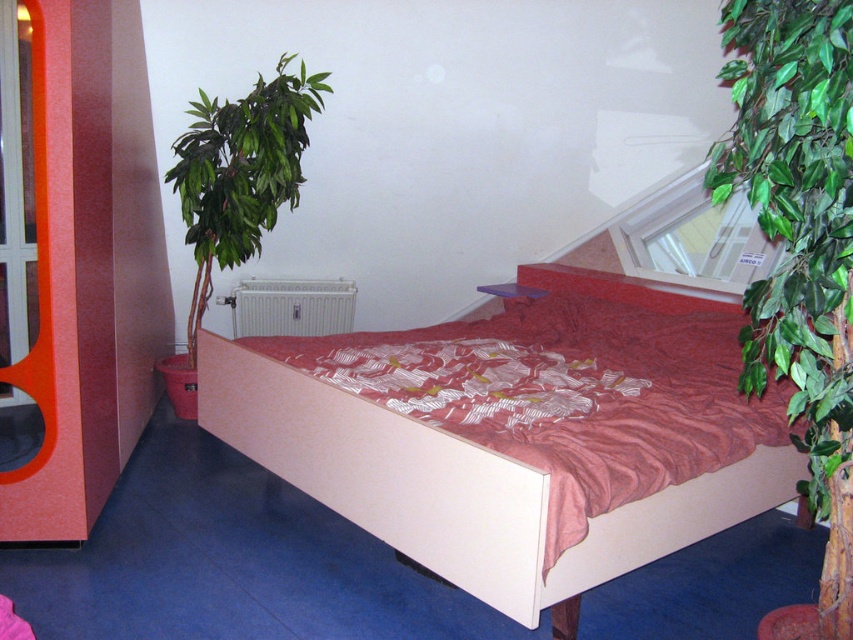
Question: Is matte white bed at center above white metallic radiator at center?

Choices:
 (A) yes
 (B) no

Answer: (B)

Question: Which object is positioned farthest from the white metallic radiator at center?

Choices:
 (A) green leafy plant at right
 (B) green leafy plant at left
 (C) matte white bed at center

Answer: (A)

Question: Which point is closer to the camera?

Choices:
 (A) (190, 364)
 (B) (289, 332)
 (C) (384, 442)
 (D) (802, 74)

Answer: (D)

Question: Which object is positioned closest to the green leafy plant at right?

Choices:
 (A) matte white bed at center
 (B) green leafy plant at left

Answer: (A)

Question: Is matte white bed at center closer to camera compared to green leafy plant at left?

Choices:
 (A) yes
 (B) no

Answer: (A)

Question: Observing the image, what is the correct spatial positioning of green leafy plant at right in reference to white metallic radiator at center?

Choices:
 (A) left
 (B) right

Answer: (B)